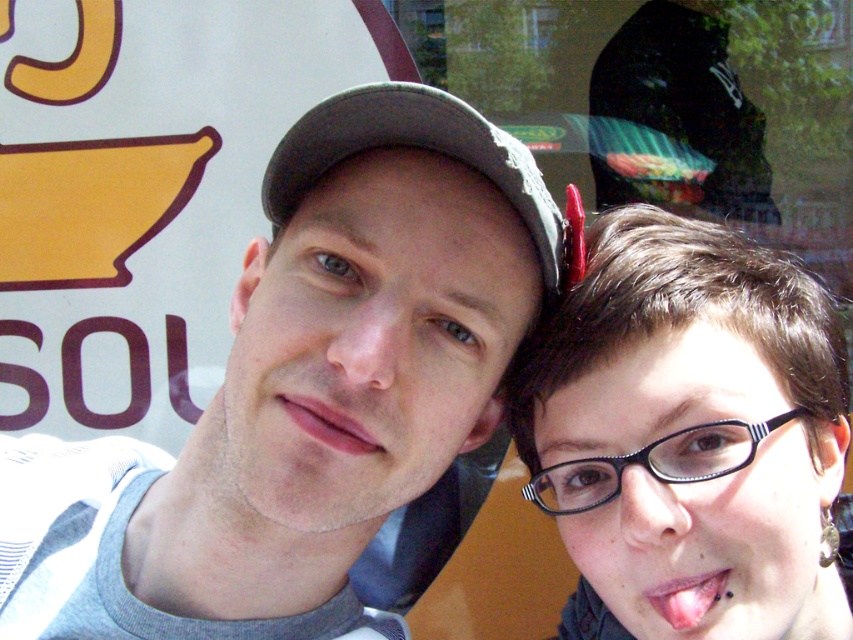
You are a photographer trying to capture a closeup of both the gray fabric cap at upper center and the black plastic glasses at right in the image. Given the current distance between them, would you need to adjust your camera lens to a wider angle to ensure both items are fully visible in the frame?

The gray fabric cap at upper center and the black plastic glasses at right are 24.76 centimeters apart. To capture both in the same frame without cropping, you would need to adjust your camera lens to a wider angle to accommodate the distance between them.

You are a photographer trying to capture a clear shot of both the gray fabric baseball cap at upper center and the pink matte lips at center. Based on their sizes in the frame, which object should you focus on first to ensure both are in focus?

The gray fabric baseball cap at upper center is much taller than the pink matte lips at center, so focusing on the larger object first will help ensure both are in focus.